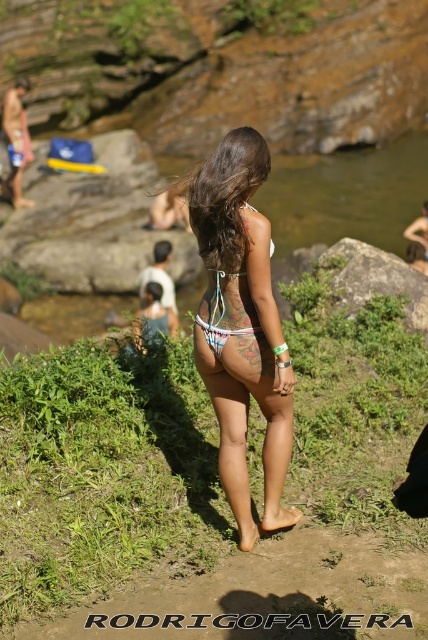
Is white string bikini at center smaller than gray rock at center?

Yes, white string bikini at center is smaller than gray rock at center.

Who is positioned more to the right, white string bikini at center or gray rock at center?

Positioned to the right is gray rock at center.

Who is more distant from viewer, (x=285, y=376) or (x=342, y=243)?

The point (x=342, y=243) is more distant.

This screenshot has height=640, width=428. In order to click on white string bikini at center in this screenshot , I will do `click(241, 326)`.

Between white string bikini at center and white fabric bikini at center, which one is positioned higher?

white fabric bikini at center

From the picture: Between white string bikini at center and white fabric bikini at center, which one appears on the right side from the viewer's perspective?

From the viewer's perspective, white string bikini at center appears more on the right side.

This screenshot has height=640, width=428. Identify the location of white string bikini at center. (241, 326).

Who is positioned more to the right, gray rock at center or white fabric bikini at center?

gray rock at center is more to the right.

What do you see at coordinates (376, 280) in the screenshot?
I see `gray rock at center` at bounding box center [376, 280].

Find the location of a particular element. The image size is (428, 640). gray rock at center is located at coordinates (376, 280).